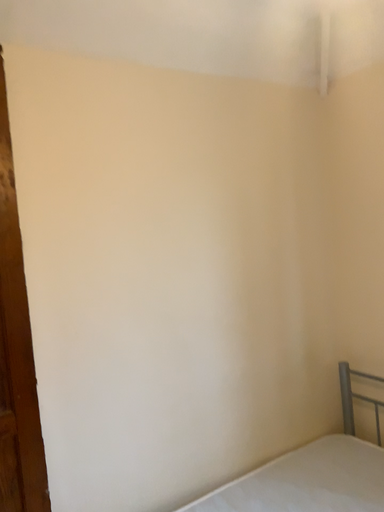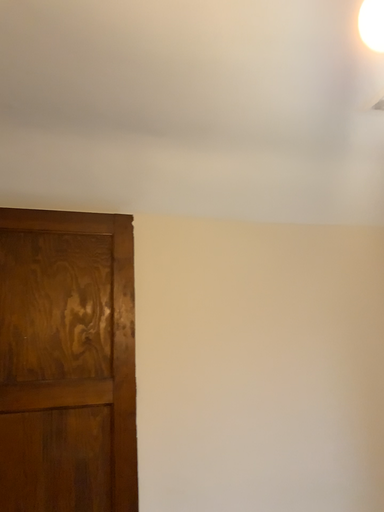
Question: How did the camera likely rotate when shooting the video?

Choices:
 (A) rotated right
 (B) rotated left

Answer: (B)